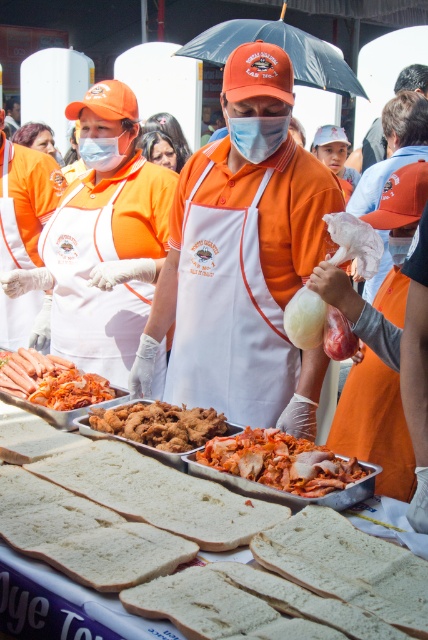
Does fried golden-brown chicken at center have a greater width compared to matte white mask at left?

Yes, fried golden-brown chicken at center is wider than matte white mask at left.

Which of these two, fried golden-brown chicken at center or matte white mask at left, stands taller?

matte white mask at left

Does point (208, 428) come closer to viewer compared to point (130, 132)?

That is True.

Where is `fried golden-brown chicken at center`? This screenshot has height=640, width=428. fried golden-brown chicken at center is located at coordinates (160, 424).

Does orange matte apron at center have a smaller size compared to bright orange sausages at center left?

Actually, orange matte apron at center might be larger than bright orange sausages at center left.

Is point (255, 160) in front of point (61, 394)?

No, it is not.

Locate an element on the screen. The width and height of the screenshot is (428, 640). orange matte apron at center is located at coordinates (243, 259).

Does spicy red meat at center have a smaller size compared to bright orange sausages at center left?

Indeed, spicy red meat at center has a smaller size compared to bright orange sausages at center left.

Between point (287, 472) and point (50, 403), which one is positioned in front?

Point (287, 472) is more forward.

Does point (253, 472) come in front of point (70, 401)?

Yes, point (253, 472) is in front of point (70, 401).

The image size is (428, 640). Identify the location of spicy red meat at center. click(x=279, y=461).